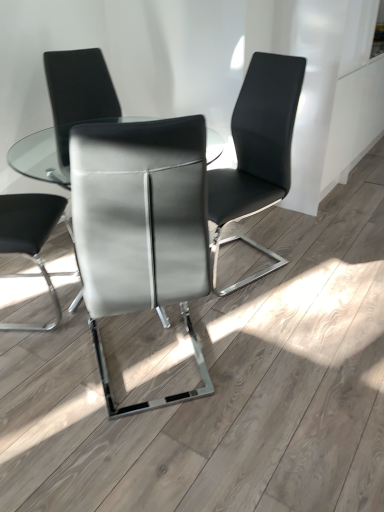
In order to click on free region under satin gray leather chair at center, marked as the second chair in a right-to-left arrangement (from a real-world perspective) in this screenshot , I will do `click(157, 372)`.